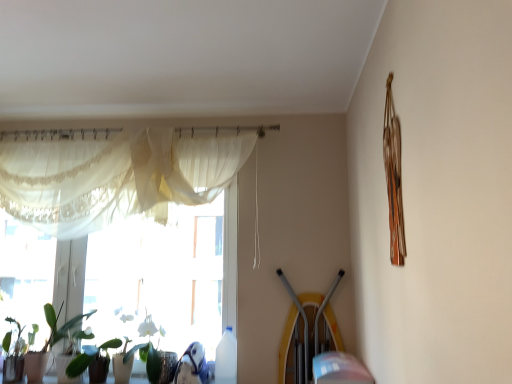
Question: Is green matte plant at lower left completely or partially inside green glossy plant at lower left?

Choices:
 (A) yes
 (B) no

Answer: (B)

Question: Considering the relative sizes of green glossy plant at lower left and green matte plant at lower left in the image provided, is green glossy plant at lower left taller than green matte plant at lower left?

Choices:
 (A) yes
 (B) no

Answer: (A)

Question: Is green glossy plant at lower left at the left side of green matte plant at lower left?

Choices:
 (A) no
 (B) yes

Answer: (B)

Question: Considering the relative sizes of green glossy plant at lower left and green matte plant at lower left in the image provided, is green glossy plant at lower left thinner than green matte plant at lower left?

Choices:
 (A) yes
 (B) no

Answer: (B)

Question: Is green glossy plant at lower left far away from green matte plant at lower left?

Choices:
 (A) yes
 (B) no

Answer: (B)

Question: Is green glossy plant at lower left further to camera compared to green matte plant at lower left?

Choices:
 (A) no
 (B) yes

Answer: (B)

Question: Could you tell me if sheer white curtain at upper left is facing green matte plant at lower left?

Choices:
 (A) yes
 (B) no

Answer: (B)

Question: Is sheer white curtain at upper left wider than green matte plant at lower left?

Choices:
 (A) yes
 (B) no

Answer: (B)

Question: Does sheer white curtain at upper left have a larger size compared to green matte plant at lower left?

Choices:
 (A) no
 (B) yes

Answer: (B)

Question: From the image's perspective, does sheer white curtain at upper left appear lower than green matte plant at lower left?

Choices:
 (A) yes
 (B) no

Answer: (B)

Question: From the image's perspective, does sheer white curtain at upper left appear higher than green matte plant at lower left?

Choices:
 (A) no
 (B) yes

Answer: (B)

Question: Does sheer white curtain at upper left have a greater height compared to green matte plant at lower left?

Choices:
 (A) yes
 (B) no

Answer: (A)

Question: Is translucent fabric at left shorter than green glossy plant at lower left?

Choices:
 (A) yes
 (B) no

Answer: (B)